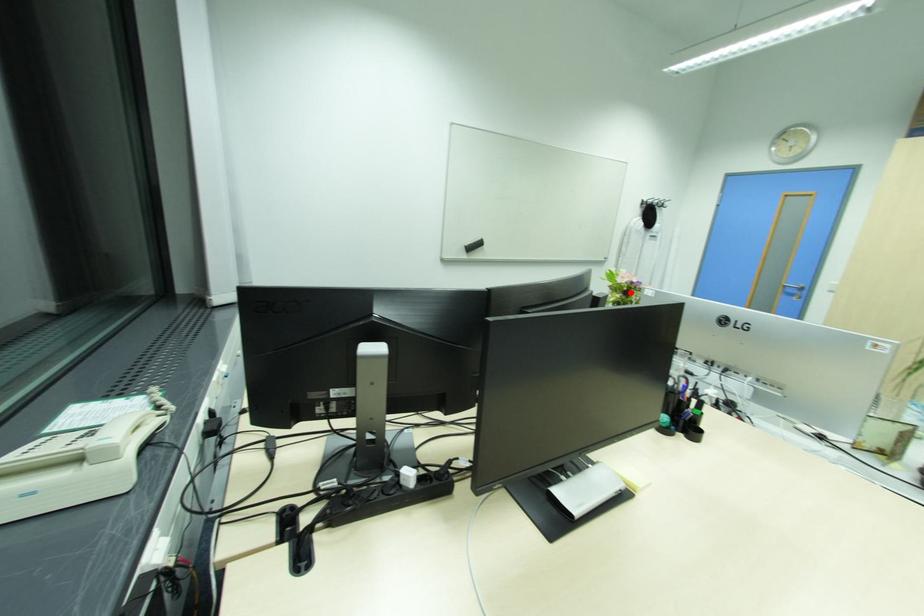
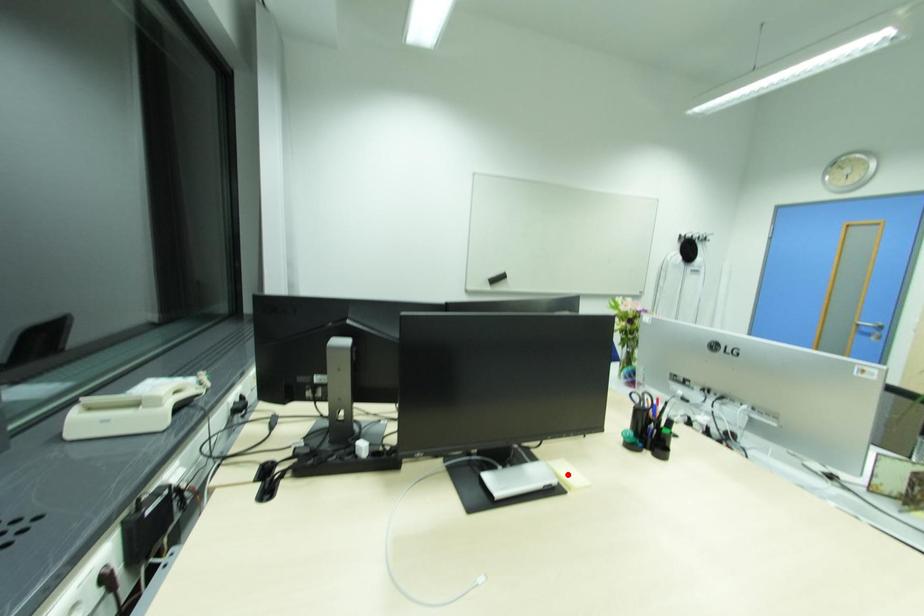
I am providing you with two images of the same scene from different viewpoints. A red point is marked on the first image and another point is marked on the second image. Does the point marked in image1 correspond to the same location as the one in image2?

No